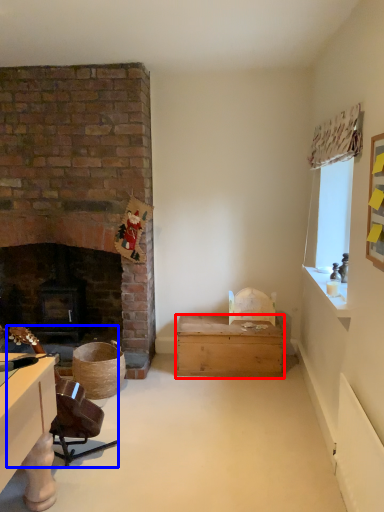
Question: Which object appears closest to the camera in this image, box (highlighted by a red box) or swivel chair (highlighted by a blue box)?

Choices:
 (A) box
 (B) swivel chair

Answer: (B)